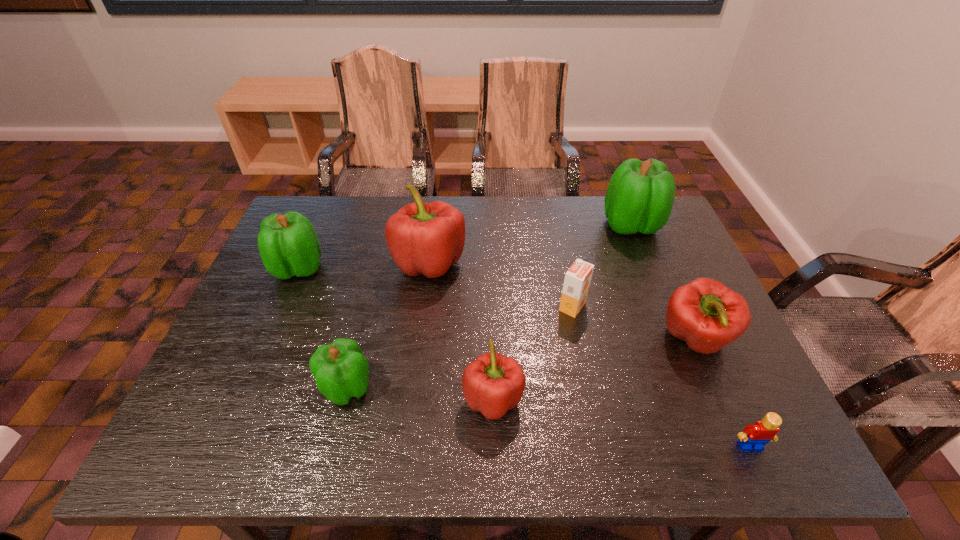
Image resolution: width=960 pixels, height=540 pixels. Identify the location of free space between the fourth object from right to left and the biggest green bell pepper. (602, 266).

The height and width of the screenshot is (540, 960). I want to click on free area in between the farthest pink bell pepper and the second biggest green bell pepper, so click(x=364, y=266).

The width and height of the screenshot is (960, 540). Find the location of `free area in between the leftmost green bell pepper and the rightmost pink bell pepper`. free area in between the leftmost green bell pepper and the rightmost pink bell pepper is located at coordinates (496, 304).

Where is `vacant space that is in between the red Lego and the orange juice`? This screenshot has width=960, height=540. vacant space that is in between the red Lego and the orange juice is located at coordinates (661, 376).

Where is `object that stands as the third closest to the nearest green bell pepper`? object that stands as the third closest to the nearest green bell pepper is located at coordinates (288, 244).

You are a GUI agent. You are given a task and a screenshot of the screen. Output one action in this format:
    pyautogui.click(x=<x>, y=<y>)
    Task: Click on the object that ranks as the sixth closest to the leftmost green bell pepper
    This screenshot has width=960, height=540.
    Given the screenshot: What is the action you would take?
    pyautogui.click(x=707, y=315)

In order to click on bell pepper that is the fifth closest one to the biggest green bell pepper in this screenshot , I will do `click(288, 244)`.

The image size is (960, 540). I want to click on bell pepper that is the closest one to the second smallest pink bell pepper, so click(x=639, y=198).

Locate which green bell pepper is the third closest to the red Lego. Please provide its 2D coordinates. Your answer should be formatted as a tuple, i.e. [(x, y)], where the tuple contains the x and y coordinates of a point satisfying the conditions above.

[(288, 244)]

Identify which green bell pepper is the second closest to the smallest green bell pepper. Please provide its 2D coordinates. Your answer should be formatted as a tuple, i.e. [(x, y)], where the tuple contains the x and y coordinates of a point satisfying the conditions above.

[(639, 198)]